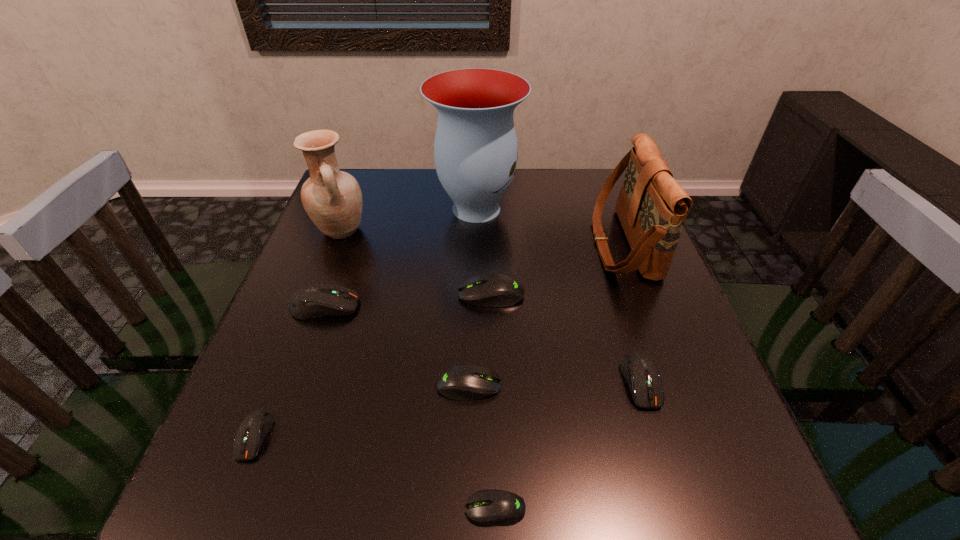
Identify the location of free region that satisfies the following two spatial constraints: 1. on the button of the farthest dark computer equipment; 2. on the button of the smallest dark computer equipment. (279, 436).

I want to click on free location that satisfies the following two spatial constraints: 1. on the wheel side of the farthest gray computer mouse; 2. on the button of the fifth farthest computer mouse, so click(x=494, y=436).

This screenshot has width=960, height=540. Identify the location of free space that satisfies the following two spatial constraints: 1. on the front-facing side of the shoulder bag; 2. on the button of the eighth farthest object. (695, 436).